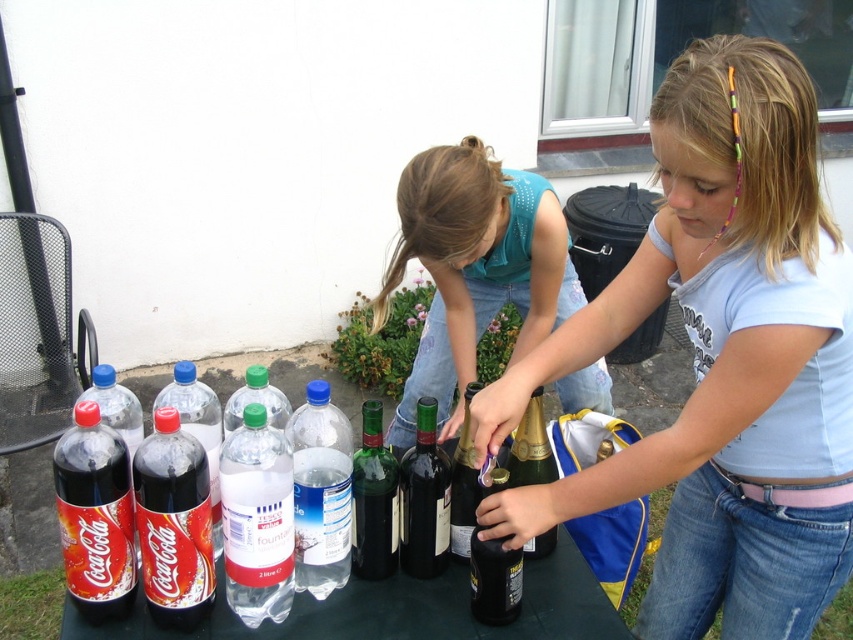
You are a delivery person who needs to place a new bottle of sparkling water between the black glass wine at center and the matte black soda at center left. Can you fit it in the space between them?

The space between the black glass wine at center and the matte black soda at center left is 16.40 inches. Since the sparkling water bottle is likely narrower than 16.40 inches, it should fit between them.